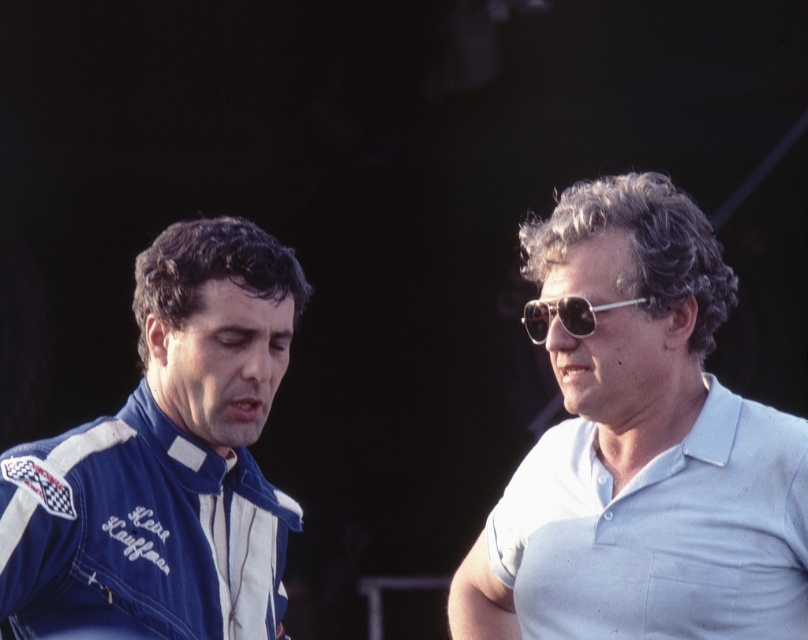
You are a photographer trying to capture a closeup shot of the light blue cotton polo shirt at right. Based on its position coordinates, where should you aim your camera?

The light blue cotton polo shirt at right is located at coordinates point [642,451], so you should aim your camera at that position to capture the closeup shot.

You are a photographer setting up a shoot. You have two items to place in the frame according to the scene description. The items are the light blue cotton polo shirt at right and the metallic silver sunglasses at upper right. Which item should you place further to the right to match the scene?

The light blue cotton polo shirt at right should be placed further to the right because it is positioned on the right side of the metallic silver sunglasses at upper right.

You are a photographer setting up a camera to capture a portrait of both people. The camera has a focus range that can cover objects within 12 inches of each other. Based on the scene, will the camera be able to focus on both the light blue cotton polo shirt at right and the metallic silver sunglasses at upper right simultaneously?

The distance between the light blue cotton polo shirt at right and the metallic silver sunglasses at upper right is 11.79 inches, which is within the camera focus range of 12 inches. Therefore, the camera can focus on both objects simultaneously.